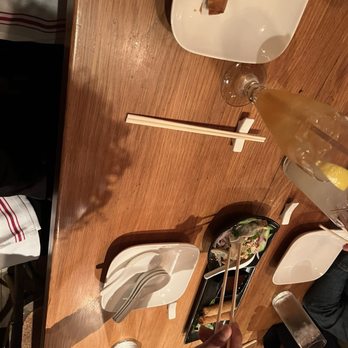
Find the location of a particular element. Image resolution: width=348 pixels, height=348 pixels. spoons is located at coordinates (143, 262), (156, 282), (150, 275), (152, 271), (248, 262).